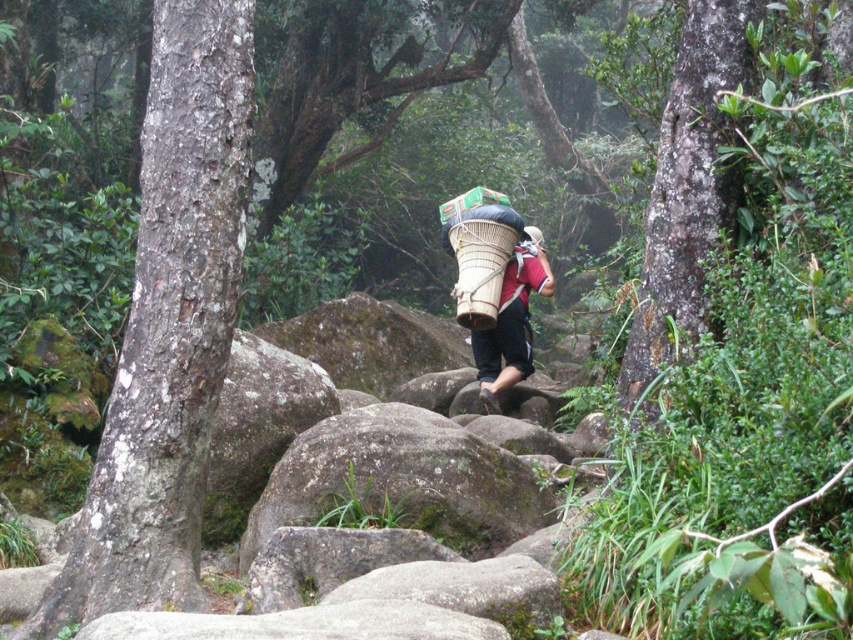
Question: Which point is farther to the camera?

Choices:
 (A) matte brown basket at center
 (B) green mossy rock at center
 (C) bamboo woven basket at center

Answer: (A)

Question: Which point is closer to the camera?

Choices:
 (A) (531, 225)
 (B) (403, 420)

Answer: (B)

Question: Does bamboo woven basket at center appear over white matte helmet at center?

Choices:
 (A) no
 (B) yes

Answer: (A)

Question: From the image, what is the correct spatial relationship of rough bark tree trunk at left in relation to white matte helmet at center?

Choices:
 (A) below
 (B) above

Answer: (A)

Question: Among these points, which one is farthest from the camera?

Choices:
 (A) (491, 257)
 (B) (461, 456)

Answer: (A)

Question: Is green mossy rock at center further to camera compared to bamboo woven basket at center?

Choices:
 (A) yes
 (B) no

Answer: (B)